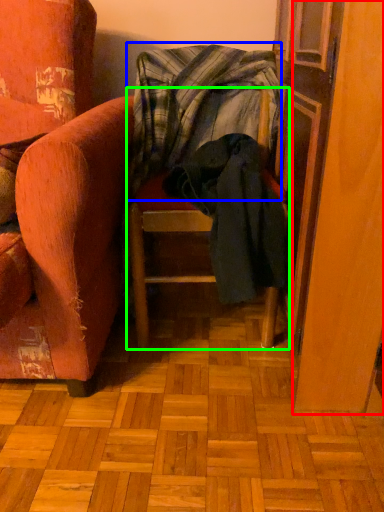
Question: Which object is positioned farthest from screen door (highlighted by a red box)? Select from blanket (highlighted by a blue box) and furniture (highlighted by a green box).

Choices:
 (A) blanket
 (B) furniture

Answer: (A)